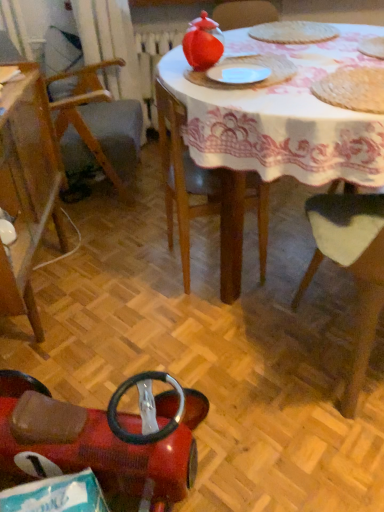
The height and width of the screenshot is (512, 384). In order to click on free location in front of white matte paper plate at center in this screenshot , I will do `click(271, 94)`.